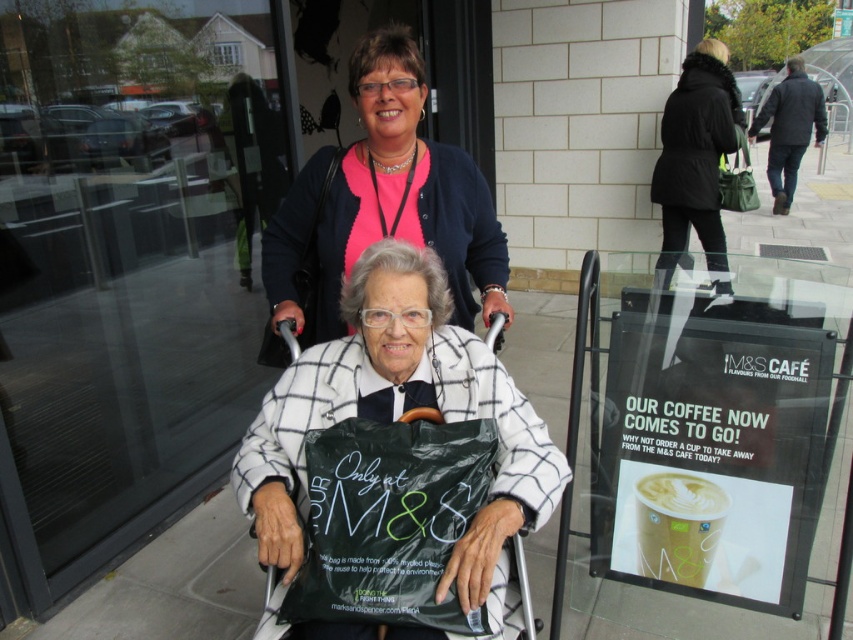
Who is positioned more to the right, black matte bag at center or dark blue jacket at upper right?

dark blue jacket at upper right is more to the right.

Is black matte bag at center to the left of dark blue jacket at upper right from the viewer's perspective?

Yes, black matte bag at center is to the left of dark blue jacket at upper right.

You are a GUI agent. You are given a task and a screenshot of the screen. Output one action in this format:
    pyautogui.click(x=<x>, y=<y>)
    Task: Click on the black matte bag at center
    The image size is (853, 640).
    Given the screenshot: What is the action you would take?
    pyautogui.click(x=389, y=520)

Does white checkered coat at center appear under dark blue jacket at upper right?

Yes.

Is point (564, 477) positioned behind point (795, 152)?

No, it is not.

Measure the distance between white checkered coat at center and camera.

white checkered coat at center and camera are 1.36 meters apart from each other.

Where is `white checkered coat at center`? The width and height of the screenshot is (853, 640). white checkered coat at center is located at coordinates (399, 417).

Is white checkered coat at center further to camera compared to black fur coat at upper right?

No, it is not.

Is point (553, 493) farther from viewer compared to point (724, 67)?

That is False.

This screenshot has width=853, height=640. I want to click on white checkered coat at center, so click(x=399, y=417).